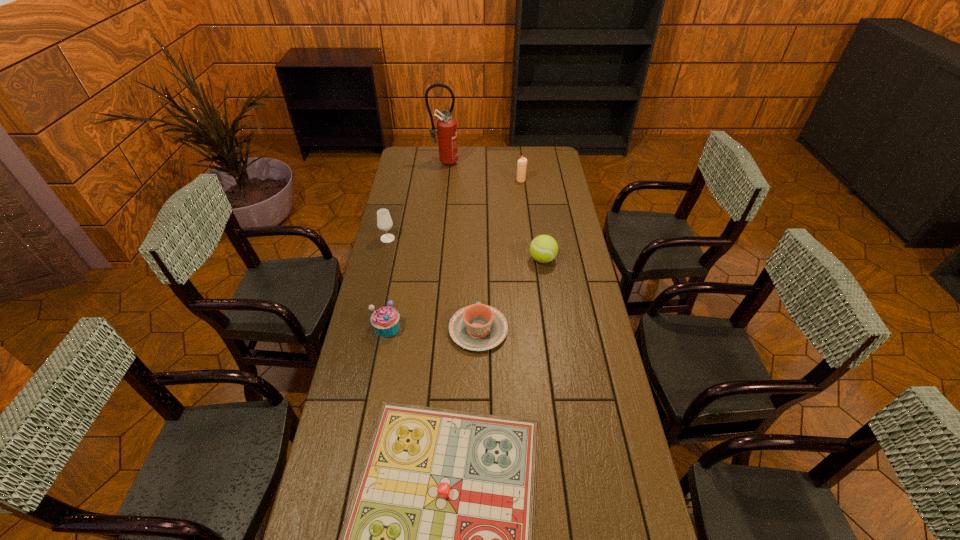
The width and height of the screenshot is (960, 540). Identify the location of unoccupied area between the chinaware and the muffin. (433, 328).

Locate an element on the screen. The width and height of the screenshot is (960, 540). the fifth closest object to the second shortest object is located at coordinates (522, 162).

Locate which object is the fifth closest to the nearest object. Please provide its 2D coordinates. Your answer should be formatted as a tuple, i.e. [(x, y)], where the tuple contains the x and y coordinates of a point satisfying the conditions above.

[(522, 162)]

This screenshot has height=540, width=960. Find the location of `free spot that satisfies the following two spatial constraints: 1. on the front side of the sixth nearest object; 2. on the left side of the tennis ball`. free spot that satisfies the following two spatial constraints: 1. on the front side of the sixth nearest object; 2. on the left side of the tennis ball is located at coordinates (530, 259).

The image size is (960, 540). I want to click on free region that satisfies the following two spatial constraints: 1. at the nozzle of the tennis ball; 2. on the left side of the tallest object, so click(x=434, y=259).

At what (x,y) coordinates should I click in order to perform the action: click on free space that satisfies the following two spatial constraints: 1. on the back side of the glass; 2. on the left side of the candle. Please return your answer as a coordinate pair (x, y). Looking at the image, I should click on (401, 180).

Locate an element on the screen. This screenshot has height=540, width=960. free space that satisfies the following two spatial constraints: 1. at the nozzle of the tallest object; 2. on the left side of the second farthest object is located at coordinates pos(443,180).

This screenshot has width=960, height=540. I want to click on free space that satisfies the following two spatial constraints: 1. on the handle side of the fourth farthest object; 2. on the left side of the second shortest object, so click(479, 259).